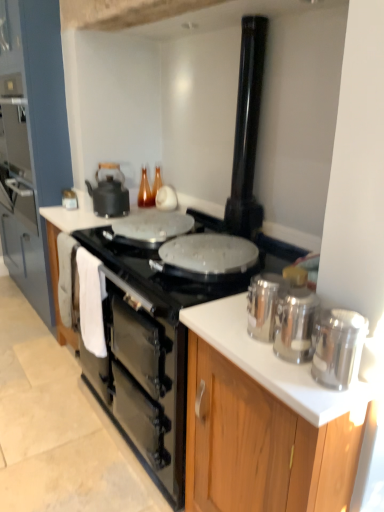
Locate an element on the screen. free space above black matte oven at center (from a real-world perspective) is located at coordinates pyautogui.click(x=38, y=418).